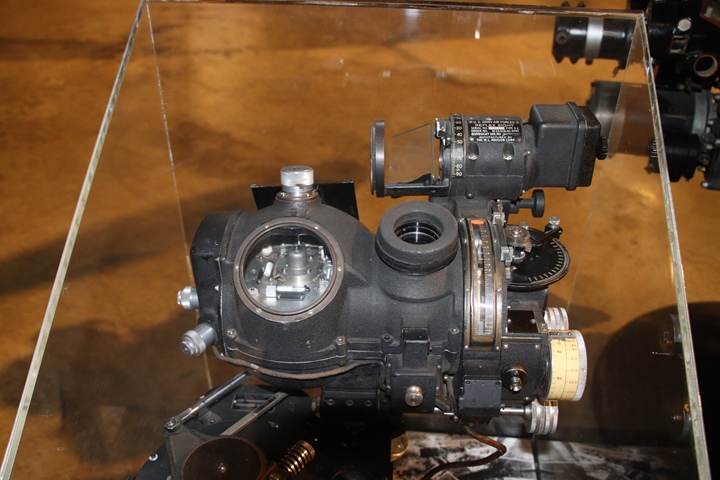
Where is `back glass case wall`? The height and width of the screenshot is (480, 720). back glass case wall is located at coordinates (253, 114).